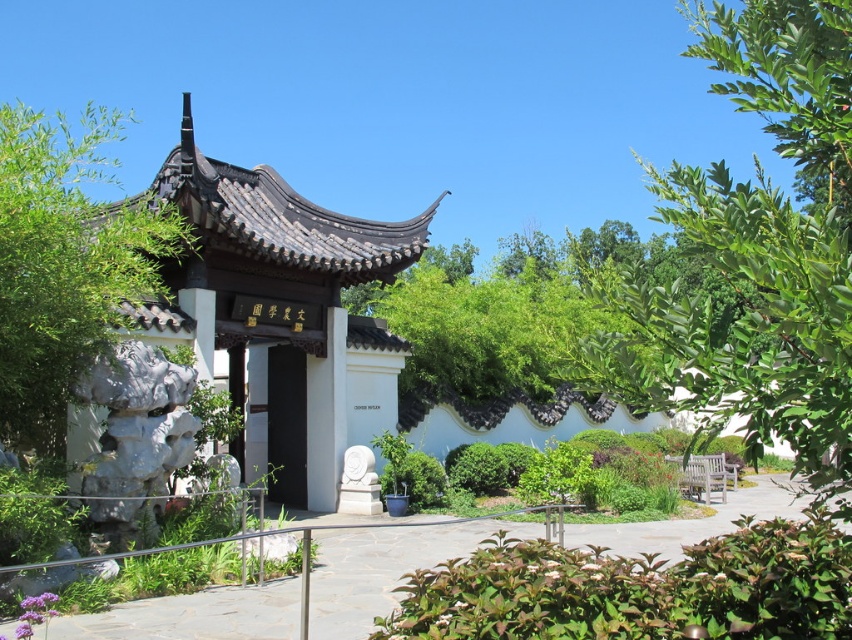
You are planning to host a small gathering in the garden. The white matte gazebo at center and the green leafy tree at left are both potential locations. Based on their sizes, which one would you choose if you want more space for guests?

The green leafy tree at left occupies more space than the white matte gazebo at center, so it would provide more space for guests.

In the scene shown: You are planning to plant a new tree in this garden. The garden has two existing trees, the green leafy tree at upper right and the green leafy tree at left. Which of these two trees has a smaller width and would require less space if you want to plant a similar sized tree nearby?

The green leafy tree at upper right has a lesser width compared to the green leafy tree at left, so it would require less space if you want to plant a similar sized tree nearby.

You are a visitor in the garden and want to take a photo of the green leafy tree at upper right while standing on the smooth stone pathway at center. Is the tree visible from your position?

The green leafy tree at upper right is located above the smooth stone pathway at center, so yes, the tree is visible from the pathway.